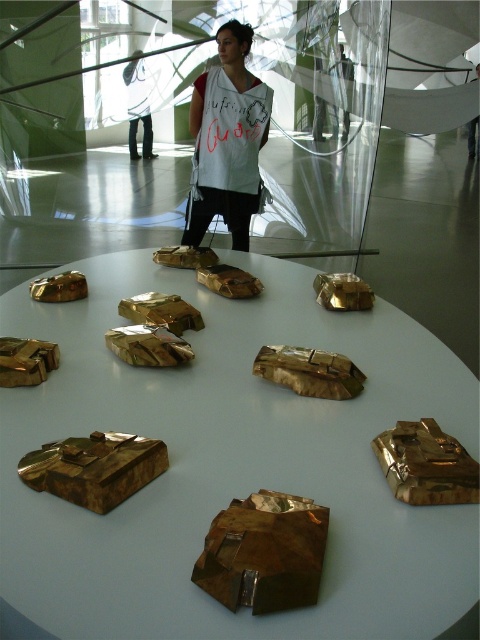
Question: Which of the following is the farthest from the observer?

Choices:
 (A) gold metallic objects at center
 (B) white paper at center
 (C) matte white shirt at center
 (D) gold metallic sculpture at lower left

Answer: (C)

Question: Is white paper at center positioned at the back of matte white shirt at center?

Choices:
 (A) yes
 (B) no

Answer: (B)

Question: Which point is closer to the camera taking this photo?

Choices:
 (A) (142, 108)
 (B) (313, 442)

Answer: (B)

Question: Is gold metallic objects at center smaller than gold reflective rock at center?

Choices:
 (A) no
 (B) yes

Answer: (A)

Question: Does gold metallic objects at center appear over gold metallic sculpture at lower left?

Choices:
 (A) yes
 (B) no

Answer: (A)

Question: Which point is closer to the camera?

Choices:
 (A) gold metallic objects at center
 (B) gold metallic sculpture at center

Answer: (A)